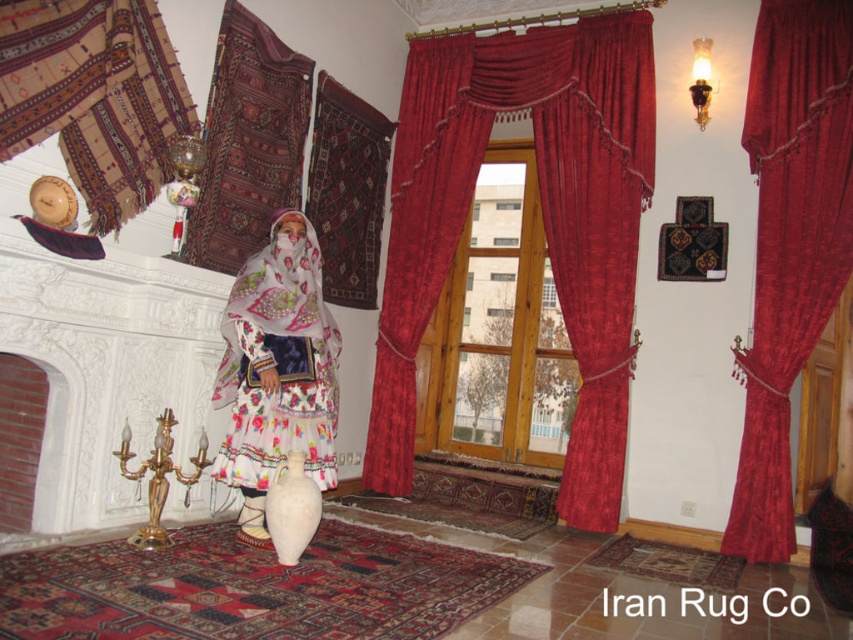
You are a visitor in this room and want to take a photo of the floral cotton dress at center without the velvet curtains at center appearing in the background. Is it possible to position yourself in a way to achieve this?

The velvet curtains at center is positioned on the right side of floral cotton dress at center, so you can move to the left side of the dress to avoid the curtains in the background.